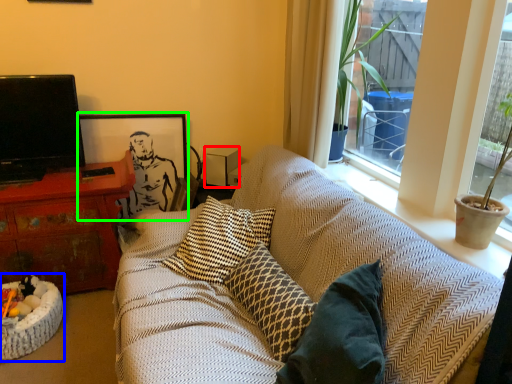
Question: Based on their relative distances, which object is nearer to loudspeaker (highlighted by a red box)? Choose from cat bed (highlighted by a blue box) and picture frame (highlighted by a green box).

Choices:
 (A) cat bed
 (B) picture frame

Answer: (B)